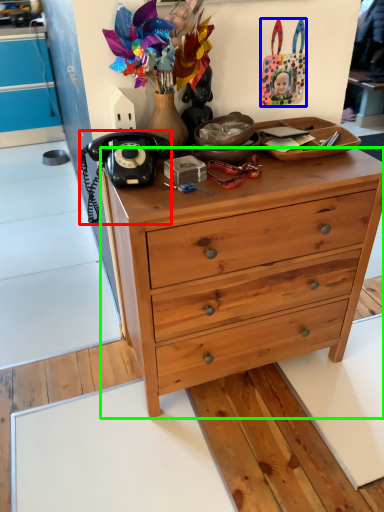
Question: Estimate the real-world distances between objects in this image. Which object is farther from corded phone (highlighted by a red box), handbag (highlighted by a blue box) or desk (highlighted by a green box)?

Choices:
 (A) handbag
 (B) desk

Answer: (A)